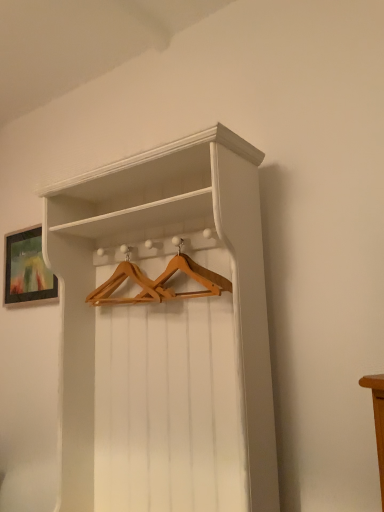
Question: Is wooden hanger at center aimed at matte black picture frame at upper left?

Choices:
 (A) no
 (B) yes

Answer: (A)

Question: Does wooden hanger at center have a lesser width compared to matte black picture frame at upper left?

Choices:
 (A) no
 (B) yes

Answer: (A)

Question: Is wooden hanger at center not near matte black picture frame at upper left?

Choices:
 (A) yes
 (B) no

Answer: (B)

Question: Is wooden hanger at center positioned before matte black picture frame at upper left?

Choices:
 (A) no
 (B) yes

Answer: (B)

Question: Can we say wooden hanger at center lies outside matte black picture frame at upper left?

Choices:
 (A) no
 (B) yes

Answer: (B)

Question: Can you confirm if wooden hanger at center is smaller than matte black picture frame at upper left?

Choices:
 (A) no
 (B) yes

Answer: (B)

Question: From a real-world perspective, is wooden hanger at center on top of white wood shelf at center?

Choices:
 (A) no
 (B) yes

Answer: (B)

Question: Considering the relative sizes of wooden hanger at center and white wood shelf at center in the image provided, is wooden hanger at center wider than white wood shelf at center?

Choices:
 (A) no
 (B) yes

Answer: (A)

Question: Does wooden hanger at center appear on the left side of white wood shelf at center?

Choices:
 (A) yes
 (B) no

Answer: (A)

Question: Considering the relative sizes of wooden hanger at center and white wood shelf at center in the image provided, is wooden hanger at center smaller than white wood shelf at center?

Choices:
 (A) yes
 (B) no

Answer: (A)

Question: Is wooden hanger at center aimed at white wood shelf at center?

Choices:
 (A) yes
 (B) no

Answer: (A)

Question: Would you say white wood shelf at center is part of wooden hanger at center's contents?

Choices:
 (A) no
 (B) yes

Answer: (A)

Question: Does white wood shelf at center turn towards matte black picture frame at upper left?

Choices:
 (A) yes
 (B) no

Answer: (B)